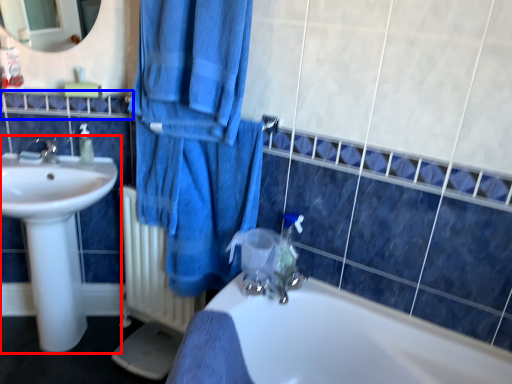
Question: Which point is further to the camera, sink (highlighted by a red box) or balustrade (highlighted by a blue box)?

Choices:
 (A) sink
 (B) balustrade

Answer: (B)